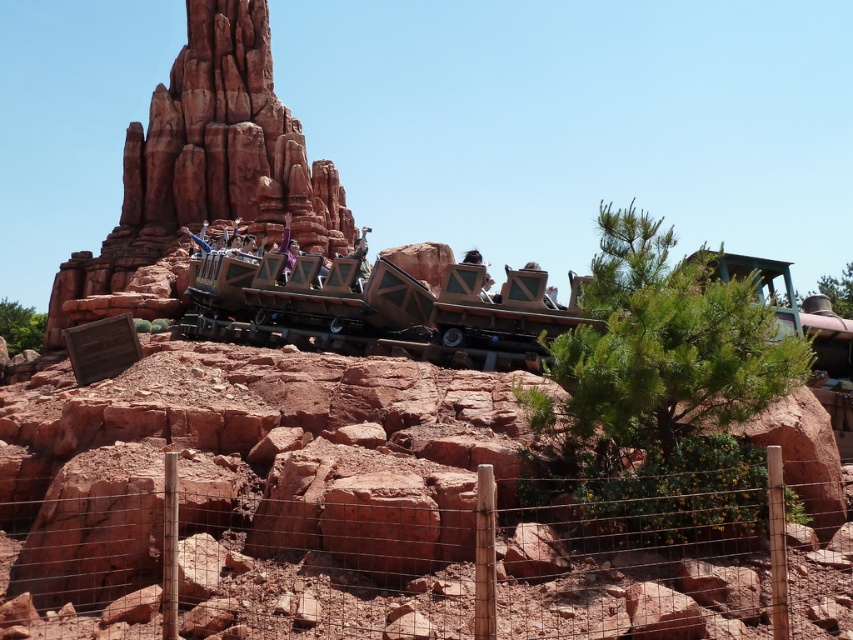
Does wire mesh fence at lower center have a larger size compared to reddish-brown stone rock formation at upper left?

No.

Does wire mesh fence at lower center have a greater height compared to reddish-brown stone rock formation at upper left?

Incorrect, wire mesh fence at lower center's height is not larger of reddish-brown stone rock formation at upper left's.

Who is more distant from viewer, (703, 506) or (263, 236)?

The point (263, 236) is more distant.

This screenshot has width=853, height=640. I want to click on wire mesh fence at lower center, so click(469, 554).